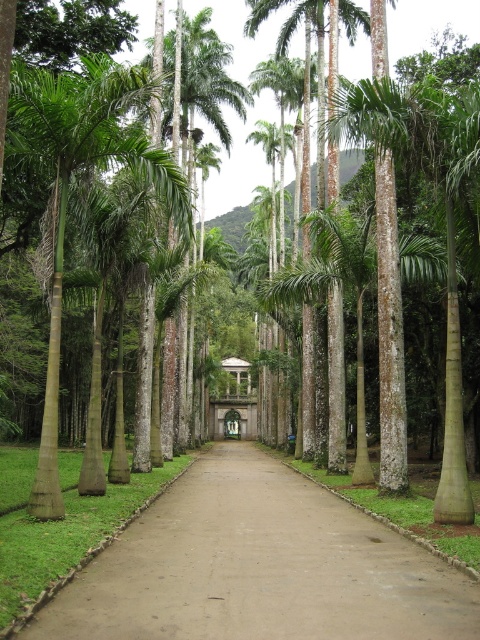
Which is behind, point (131, 108) or point (181, 54)?

Point (181, 54)

Who is more distant from viewer, (110, 68) or (201, 52)?

Point (201, 52)

The width and height of the screenshot is (480, 640). Find the location of `green smooth palm tree at left`. green smooth palm tree at left is located at coordinates (69, 188).

The height and width of the screenshot is (640, 480). What do you see at coordinates (259, 566) in the screenshot?
I see `brown dirt path at center` at bounding box center [259, 566].

Consider the image. Is brown dirt path at center taller than green textured palm tree at center?

In fact, brown dirt path at center may be shorter than green textured palm tree at center.

Who is more forward, (332,540) or (256,19)?

Point (332,540) is in front.

Locate an element on the screen. This screenshot has width=480, height=640. brown dirt path at center is located at coordinates (259, 566).

Can you confirm if green leafy palm tree at center is bigger than green textured palm tree at center?

Yes.

Consider the image. Which of these two, green leafy palm tree at center or green textured palm tree at center, stands shorter?

green textured palm tree at center

The image size is (480, 640). Identify the location of green leafy palm tree at center. (204, 77).